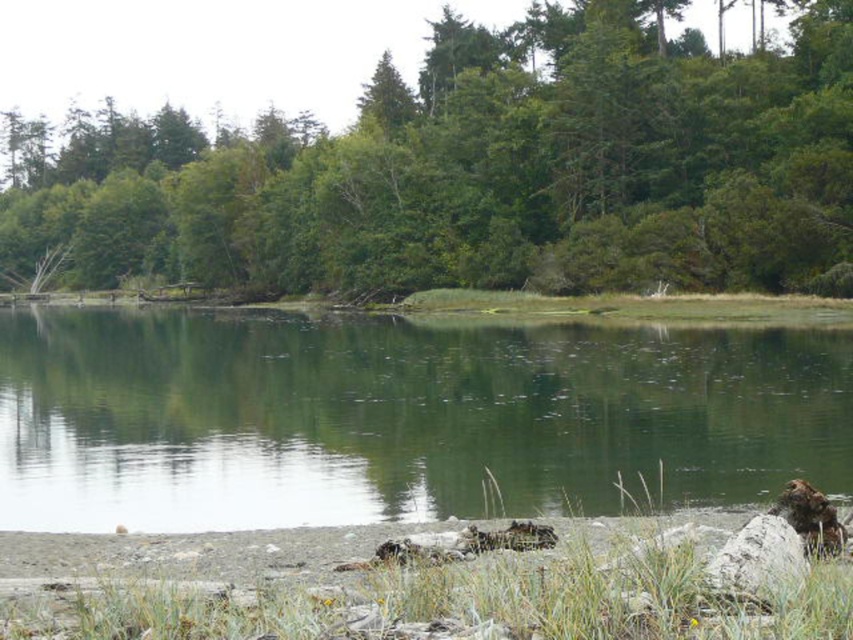
You are standing at the point closer to the camera between the two points, point [311,240] and point [724,544]. Which point are you standing at?

You are standing at point [311,240] because it is further to the camera than point [724,544].

You are standing on the white smooth rock at lower right and want to reach the green reflective water at center. Which direction should you move to get to the water?

You should move upwards to reach the green reflective water at center because it is positioned over the white smooth rock at lower right.